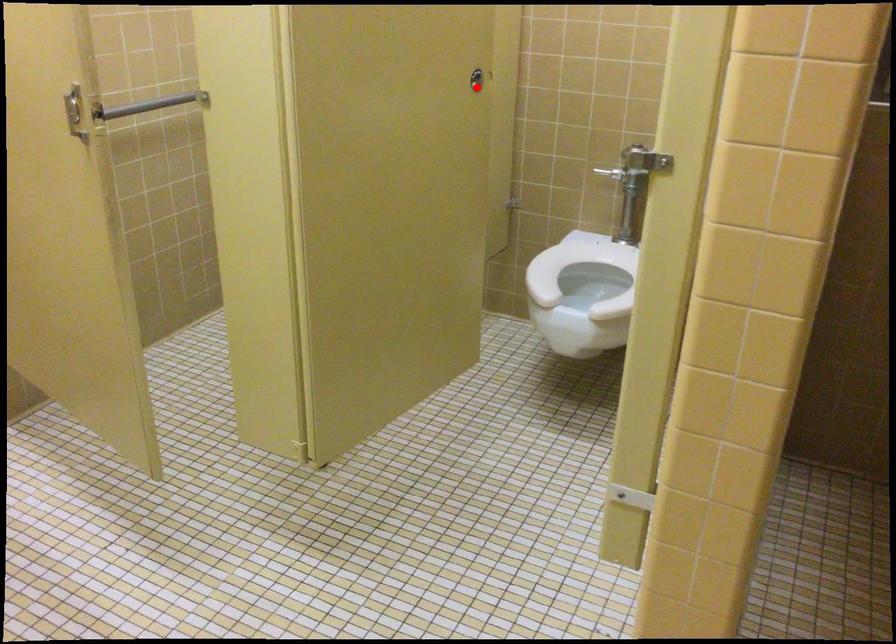
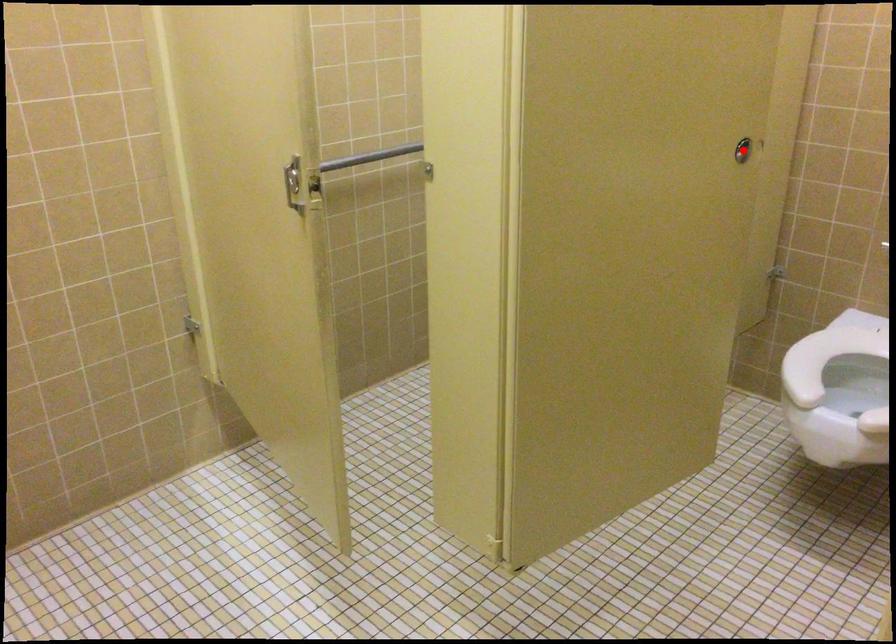
I am providing you with two images of the same scene from different viewpoints. A red point is marked on the first image and another point is marked on the second image. Is the marked point in image1 the same physical position as the marked point in image2?

Yes